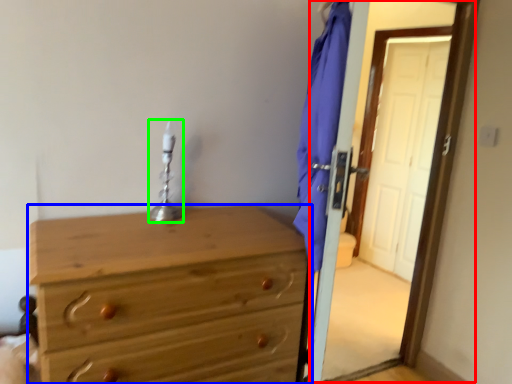
Question: Which is nearer to the screen door (highlighted by a red box)? chest of drawers (highlighted by a blue box) or table lamp (highlighted by a green box).

Choices:
 (A) chest of drawers
 (B) table lamp

Answer: (B)